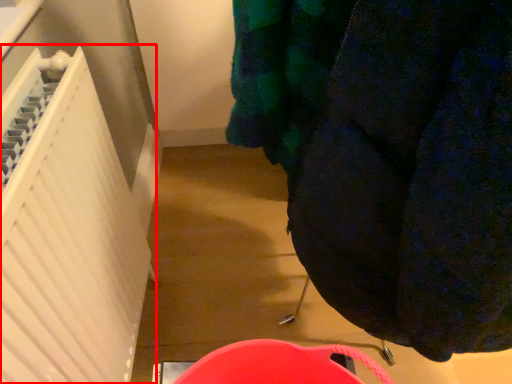
Question: Considering the relative positions of radiator (annotated by the red box) and clothing in the image provided, where is radiator (annotated by the red box) located with respect to the staircase?

Choices:
 (A) right
 (B) left

Answer: (B)